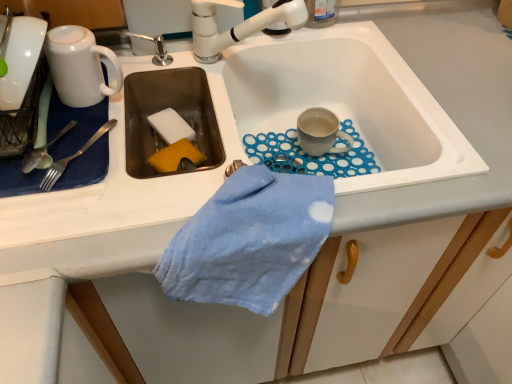
The image size is (512, 384). What do you see at coordinates (170, 126) in the screenshot?
I see `white sponge at sink left` at bounding box center [170, 126].

What do you see at coordinates (320, 132) in the screenshot? This screenshot has height=384, width=512. I see `matte gray mug at sink right, which is the second coffee cup in left-to-right order` at bounding box center [320, 132].

Describe the element at coordinates (353, 100) in the screenshot. The image size is (512, 384). I see `white ceramic sink at center` at that location.

You are a GUI agent. You are given a task and a screenshot of the screen. Output one action in this format:
    pyautogui.click(x=<x>, y=<y>)
    Task: Click on the white ceramic tap at upper center
    Image resolution: width=512 pixels, height=384 pixels.
    Given the screenshot: What is the action you would take?
    pyautogui.click(x=237, y=25)

How far apart are white sponge at sink left and white ceramic tap at upper center?

The distance of white sponge at sink left from white ceramic tap at upper center is 7.99 inches.

Considering the sizes of objects white sponge at sink left and white ceramic tap at upper center in the image provided, who is wider, white sponge at sink left or white ceramic tap at upper center?

Wider between the two is white ceramic tap at upper center.

Consider the image. Can you confirm if white sponge at sink left is positioned to the left of white ceramic tap at upper center?

Yes.

Are white sponge at sink left and white ceramic tap at upper center located far from each other?

No, white sponge at sink left is not far away from white ceramic tap at upper center.

Could shiny silver fork at left, which is counted as the 3th silverware, starting from the right, be considered to be inside matte gray mug at sink right, acting as the 1th coffee cup starting from the back?

No, shiny silver fork at left, which is counted as the 3th silverware, starting from the right, is not a part of matte gray mug at sink right, acting as the 1th coffee cup starting from the back.

Between matte gray mug at sink right, which appears as the 1th coffee cup when viewed from the right, and shiny silver fork at left, the 1th silverware positioned from the left, which one appears on the right side from the viewer's perspective?

From the viewer's perspective, matte gray mug at sink right, which appears as the 1th coffee cup when viewed from the right, appears more on the right side.

Consider the image. Does matte gray mug at sink right, acting as the 1th coffee cup starting from the back, have a lesser width compared to shiny silver fork at left, the 1th silverware positioned from the left?

Yes.

Is matte gray mug at sink right, acting as the 1th coffee cup starting from the back, in front of or behind shiny silver fork at left, the 1th silverware positioned from the left, in the image?

matte gray mug at sink right, acting as the 1th coffee cup starting from the back, is behind shiny silver fork at left, the 1th silverware positioned from the left.

Is white sponge at sink left wider than white ceramic sink at center?

No.

Looking at the image, does white sponge at sink left seem bigger or smaller compared to white ceramic sink at center?

Considering their sizes, white sponge at sink left takes up less space than white ceramic sink at center.

From a real-world perspective, which object stands above the other?

In real-world perspective, white ceramic sink at center is above.

How many degrees apart are the facing directions of matte gray mug at sink right, acting as the 1th coffee cup starting from the back, and satin silver spoon at left, arranged as the 2th silverware when viewed from the right?

They differ by 26.3 degrees in their facing directions.

Between point (302, 114) and point (29, 171), which one is positioned in front?

The point (29, 171) is more forward.

Considering the sizes of objects matte gray mug at sink right, the 2th coffee cup positioned from the front, and satin silver spoon at left, the second silverware positioned from the left, in the image provided, who is smaller, matte gray mug at sink right, the 2th coffee cup positioned from the front, or satin silver spoon at left, the second silverware positioned from the left,?

Smaller between the two is satin silver spoon at left, the second silverware positioned from the left.

Find the location of a particular element. This screenshot has height=384, width=512. coffee cup that is the 1st object located above the satin silver spoon at left, arranged as the 2th silverware when viewed from the right (from the image's perspective) is located at coordinates (320, 132).

Which object is positioned more to the left, shiny silver fork at left, which is counted as the 3th silverware, starting from the right, or satin silver fork at left, the first silverware from the right?

shiny silver fork at left, which is counted as the 3th silverware, starting from the right, is more to the left.

Does shiny silver fork at left, the 1th silverware positioned from the left, touch satin silver fork at left, the first silverware from the right?

Yes, shiny silver fork at left, the 1th silverware positioned from the left, is beside satin silver fork at left, the first silverware from the right.

From the image's perspective, is shiny silver fork at left, which is counted as the 3th silverware, starting from the right, under satin silver fork at left, which is the third silverware from left to right?

Actually, shiny silver fork at left, which is counted as the 3th silverware, starting from the right, appears above satin silver fork at left, which is the third silverware from left to right, in the image.

Does point (49, 156) come closer to viewer compared to point (65, 168)?

No, it is not.

Locate an element on the screen. coffee cup positioned vertically above the white sponge at sink left (from a real-world perspective) is located at coordinates (79, 66).

Is white glossy mug at upper left, the 2th coffee cup viewed from the back, far from white sponge at sink left?

No, white glossy mug at upper left, the 2th coffee cup viewed from the back, is not far from white sponge at sink left.

Is white glossy mug at upper left, the first coffee cup viewed from the left, taller than white sponge at sink left?

Indeed, white glossy mug at upper left, the first coffee cup viewed from the left, has a greater height compared to white sponge at sink left.

Is white glossy mug at upper left, the first coffee cup viewed from the left, located outside white sponge at sink left?

white glossy mug at upper left, the first coffee cup viewed from the left, lies outside white sponge at sink left's area.

From the image's perspective, between white ceramic tap at upper center and satin silver fork at left, which is the third silverware from left to right, who is located below?

satin silver fork at left, which is the third silverware from left to right, appears lower in the image.

Is there a large distance between white ceramic tap at upper center and satin silver fork at left, the first silverware from the right?

white ceramic tap at upper center is near satin silver fork at left, the first silverware from the right, not far away.

Is white ceramic tap at upper center closer to the viewer compared to satin silver fork at left, which is the third silverware from left to right?

No.

Considering the sizes of white ceramic tap at upper center and satin silver fork at left, which is the third silverware from left to right, in the image, is white ceramic tap at upper center taller or shorter than satin silver fork at left, which is the third silverware from left to right,?

In the image, white ceramic tap at upper center appears to be taller than satin silver fork at left, which is the third silverware from left to right.

At what (x,y) coordinates should I click in order to perform the action: click on tap above the white sponge at sink left (from the image's perspective). Please return your answer as a coordinate pair (x, y). This screenshot has height=384, width=512. Looking at the image, I should click on (237, 25).

Identify the location of coffee cup that appears below the shiny silver fork at left, the 1th silverware positioned from the left (from a real-world perspective). This screenshot has width=512, height=384. (320, 132).

Based on their spatial positions, is matte gray mug at sink right, acting as the 1th coffee cup starting from the back, or shiny silver fork at left, the 1th silverware positioned from the left, closer to white sponge at sink left?

Based on the image, shiny silver fork at left, the 1th silverware positioned from the left, appears to be nearer to white sponge at sink left.

Based on their spatial positions, is shiny silver fork at left, which is counted as the 3th silverware, starting from the right, or white sponge at sink left closer to white ceramic tap at upper center?

white sponge at sink left.

From the picture: Estimate the real-world distances between objects in this image. Which object is further from satin silver spoon at left, arranged as the 2th silverware when viewed from the right, white ceramic tap at upper center or shiny silver fork at left, which is counted as the 3th silverware, starting from the right?

white ceramic tap at upper center is further to satin silver spoon at left, arranged as the 2th silverware when viewed from the right.

Estimate the real-world distances between objects in this image. Which object is closer to matte gray mug at sink right, acting as the 1th coffee cup starting from the back, white glossy mug at upper left, the 2th coffee cup viewed from the back, or white ceramic tap at upper center?

Based on the image, white ceramic tap at upper center appears to be nearer to matte gray mug at sink right, acting as the 1th coffee cup starting from the back.

Estimate the real-world distances between objects in this image. Which object is further from shiny silver fork at left, the 1th silverware positioned from the left, white ceramic sink at center or satin silver spoon at left, arranged as the 2th silverware when viewed from the right?

Among the two, white ceramic sink at center is located further to shiny silver fork at left, the 1th silverware positioned from the left.

Which object lies further to the anchor point shiny silver fork at left, the 1th silverware positioned from the left, satin silver fork at left, the first silverware from the right, or white ceramic sink at center?

Among the two, white ceramic sink at center is located further to shiny silver fork at left, the 1th silverware positioned from the left.

Estimate the real-world distances between objects in this image. Which object is closer to white glossy mug at upper left, the first coffee cup viewed from the left, white sponge at sink left or satin silver fork at left, the first silverware from the right?

satin silver fork at left, the first silverware from the right, is positioned closer to the anchor white glossy mug at upper left, the first coffee cup viewed from the left.

From the image, which object appears to be farther from white ceramic sink at center, shiny silver fork at left, the 1th silverware positioned from the left, or matte gray mug at sink right, the 2th coffee cup positioned from the front?

Among the two, shiny silver fork at left, the 1th silverware positioned from the left, is located further to white ceramic sink at center.

I want to click on tap between white sponge at sink left and white ceramic sink at center from left to right, so click(x=237, y=25).

Where is `coffee cup located between shiny silver fork at left, which is counted as the 3th silverware, starting from the right, and white ceramic sink at center in the left-right direction`? coffee cup located between shiny silver fork at left, which is counted as the 3th silverware, starting from the right, and white ceramic sink at center in the left-right direction is located at coordinates (79, 66).

In order to click on sink located between shiny silver fork at left, which is counted as the 3th silverware, starting from the right, and matte gray mug at sink right, acting as the 1th coffee cup starting from the back, in the left-right direction in this screenshot , I will do click(x=353, y=100).

Where is `sink between satin silver fork at left, which is the third silverware from left to right, and matte gray mug at sink right, the 2th coffee cup positioned from the front, from left to right`? sink between satin silver fork at left, which is the third silverware from left to right, and matte gray mug at sink right, the 2th coffee cup positioned from the front, from left to right is located at coordinates (353, 100).